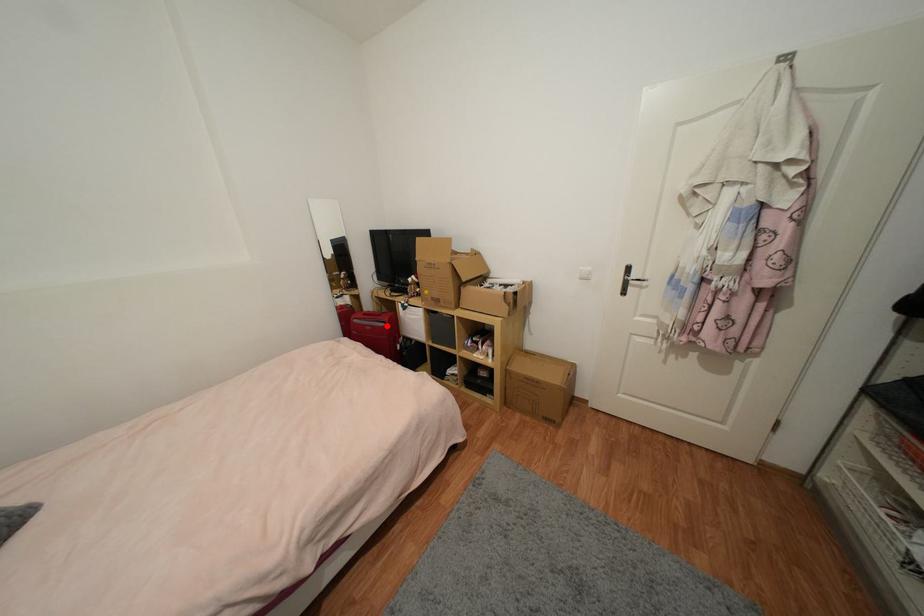
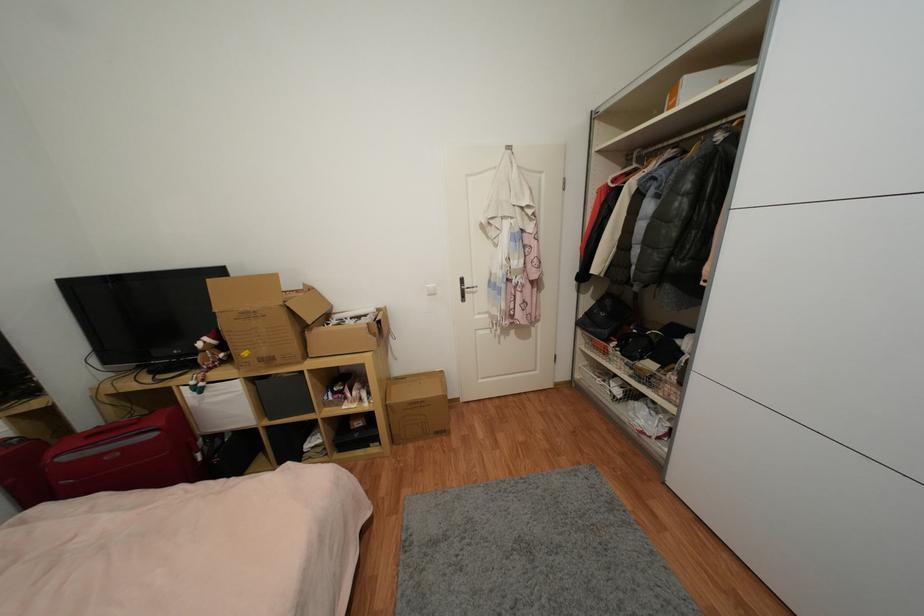
Question: I am providing you with two images of the same scene from different viewpoints. A red point is marked on the first image. Can you still see the location of the red point in image 2?

Choices:
 (A) Yes
 (B) No

Answer: (A)